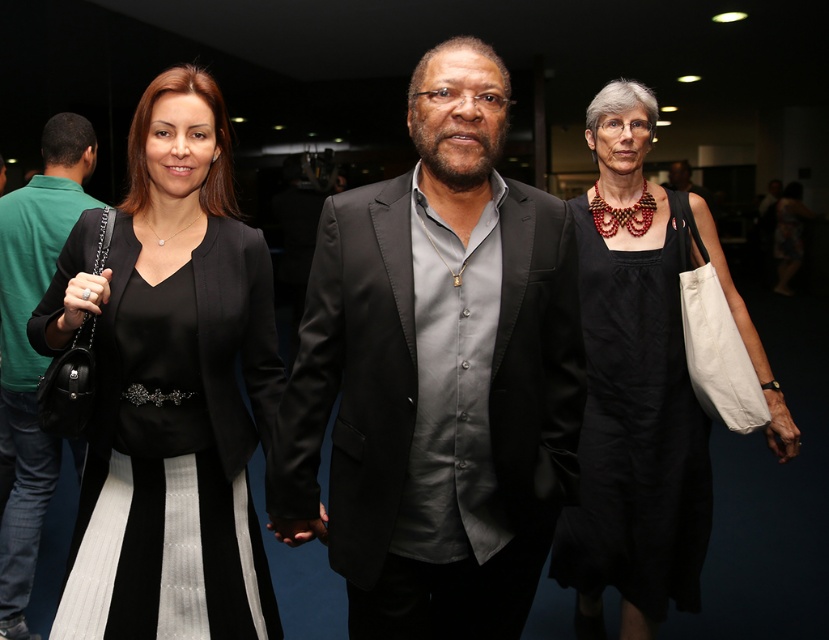
Question: Where is black satin dress at left located in relation to matte black blazer at center in the image?

Choices:
 (A) left
 (B) right

Answer: (B)

Question: Which of these objects is positioned closest to the satin black suit at center?

Choices:
 (A) black satin dress at left
 (B) matte black blazer at center

Answer: (A)

Question: Which point appears farthest from the camera in this image?

Choices:
 (A) (701, 192)
 (B) (197, 433)
 (C) (11, 538)

Answer: (A)

Question: Which object is farther from the camera taking this photo?

Choices:
 (A) matte black blazer at center
 (B) satin black suit at center
 (C) black satin dress at left
 (D) matte black suit at center

Answer: (D)

Question: Does satin black suit at center appear under black satin dress at left?

Choices:
 (A) no
 (B) yes

Answer: (A)

Question: Can you confirm if black cotton dress at right is positioned to the right of matte black blazer at center?

Choices:
 (A) no
 (B) yes

Answer: (B)